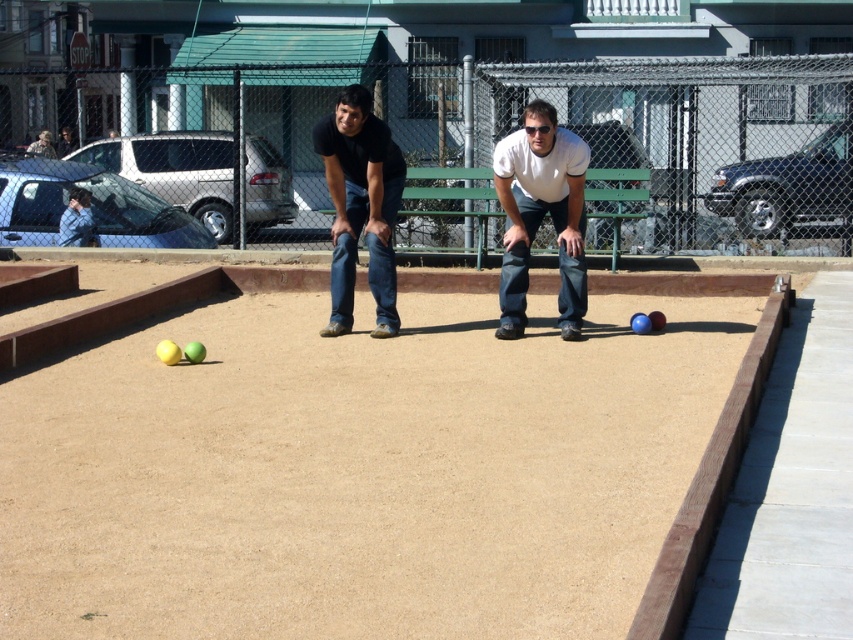
Who is positioned more to the left, white matte shirt at center or black matte jeans at center?

black matte jeans at center is more to the left.

Is white matte shirt at center behind black matte jeans at center?

No.

Does point (567, 337) lie in front of point (361, 150)?

No, (567, 337) is further to viewer.

Identify the location of white matte shirt at center. [x=541, y=214].